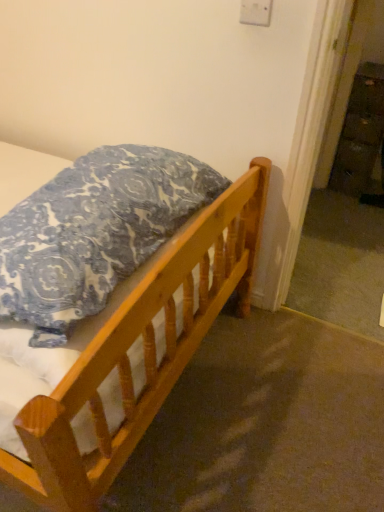
Question: Is wooden bed at lower left in front of or behind wooden dresser at right in the image?

Choices:
 (A) behind
 (B) front

Answer: (B)

Question: Visually, is wooden bed at lower left positioned to the left or to the right of wooden dresser at right?

Choices:
 (A) left
 (B) right

Answer: (A)

Question: Estimate the real-world distances between objects in this image. Which object is closer to the blue patterned pillow at upper left?

Choices:
 (A) wooden dresser at right
 (B) wooden bed at lower left

Answer: (B)

Question: Based on their relative distances, which object is nearer to the wooden dresser at right?

Choices:
 (A) blue patterned pillow at upper left
 (B) wooden bed at lower left

Answer: (B)